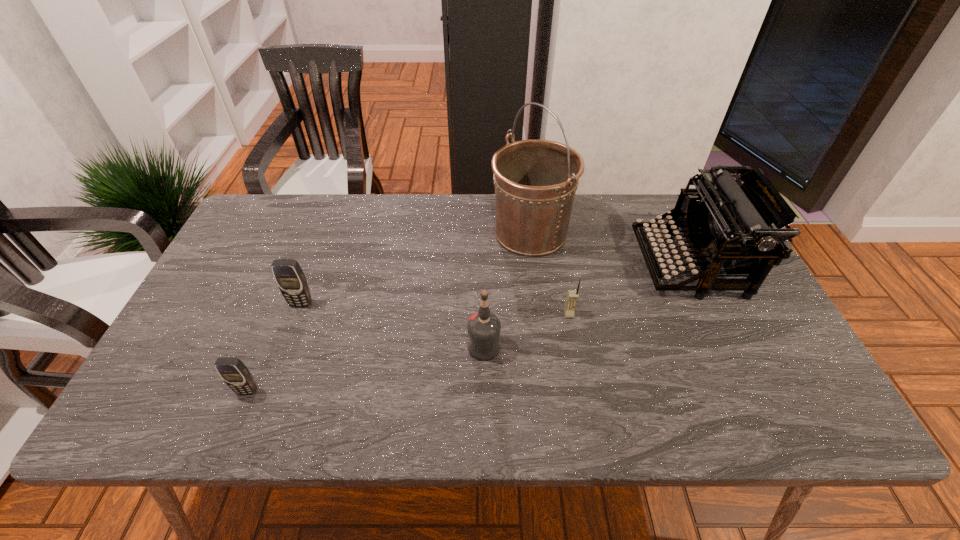
This screenshot has width=960, height=540. I want to click on vacant area between the second tallest object and the fourth farthest object, so 629,289.

You are a GUI agent. You are given a task and a screenshot of the screen. Output one action in this format:
    pyautogui.click(x=<x>, y=<y>)
    Task: Click on the vacant space that's between the farthest cellular telephone and the bucket
    
    Given the screenshot: What is the action you would take?
    pyautogui.click(x=416, y=268)

At what (x,y) coordinates should I click in order to perform the action: click on vacant region between the farthest cellular telephone and the nearest object. Please return your answer as a coordinate pair (x, y). Image resolution: width=960 pixels, height=540 pixels. Looking at the image, I should click on (275, 348).

Locate an element on the screen. The image size is (960, 540). unoccupied area between the second farthest cellular telephone and the nearest object is located at coordinates (408, 353).

Locate an element on the screen. Image resolution: width=960 pixels, height=540 pixels. free space between the rightmost object and the rightmost cellular telephone is located at coordinates (629, 289).

What are the coordinates of `vacant area between the second nearest object and the farthest cellular telephone` in the screenshot? It's located at [393, 326].

At what (x,y) coordinates should I click in order to perform the action: click on empty space that is in between the nearest object and the bucket. Please return your answer as a coordinate pair (x, y). Looking at the image, I should click on (389, 312).

The height and width of the screenshot is (540, 960). Find the location of `vacant area between the tallest object and the nearest object`. vacant area between the tallest object and the nearest object is located at coordinates click(x=389, y=312).

The image size is (960, 540). In order to click on unoccupied area between the nearest object and the third nearest object in this screenshot , I will do `click(408, 353)`.

Point out which object is positioned as the second nearest to the vodka. Please provide its 2D coordinates. Your answer should be formatted as a tuple, i.e. [(x, y)], where the tuple contains the x and y coordinates of a point satisfying the conditions above.

[(535, 181)]